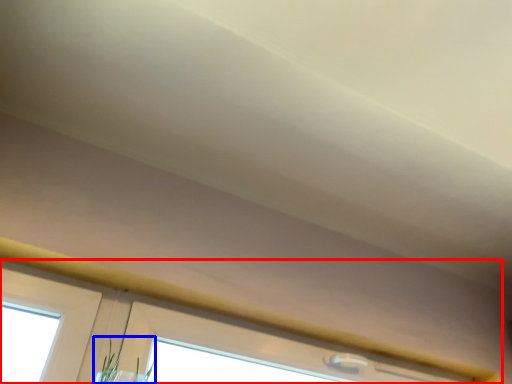
Question: Which of the following is the farthest to the observer, window (highlighted by a red box) or plant (highlighted by a blue box)?

Choices:
 (A) window
 (B) plant

Answer: (A)